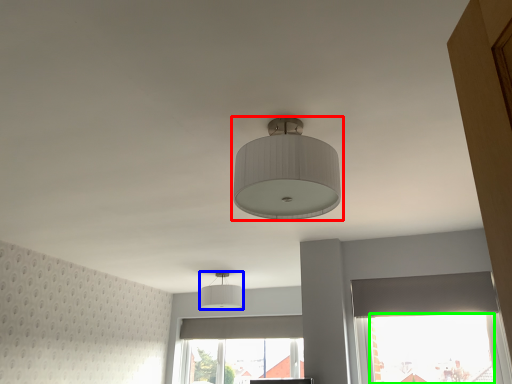
Question: Which object is positioned closest to lamp (highlighted by a red box)? Select from lamp (highlighted by a blue box) and window screen (highlighted by a green box).

Choices:
 (A) lamp
 (B) window screen

Answer: (B)